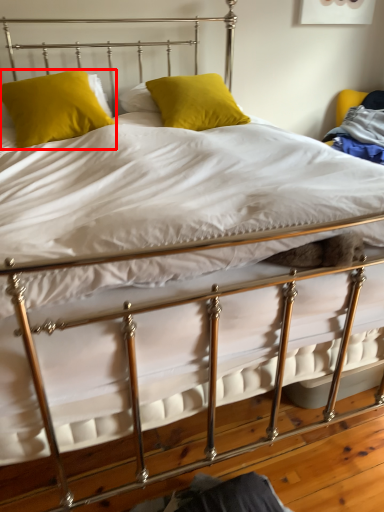
Question: Where is pillow (annotated by the red box) located in relation to pillow in the image?

Choices:
 (A) right
 (B) left

Answer: (B)